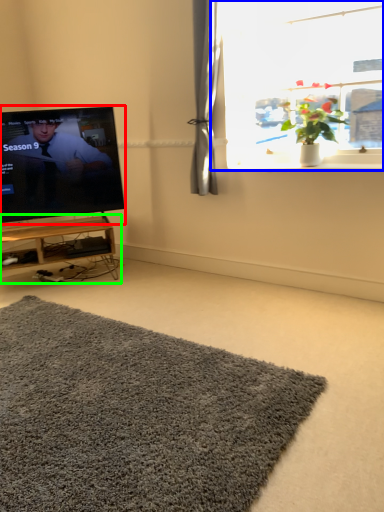
Question: Estimate the real-world distances between objects in this image. Which object is closer to television (highlighted by a red box), window (highlighted by a blue box) or table (highlighted by a green box)?

Choices:
 (A) window
 (B) table

Answer: (B)